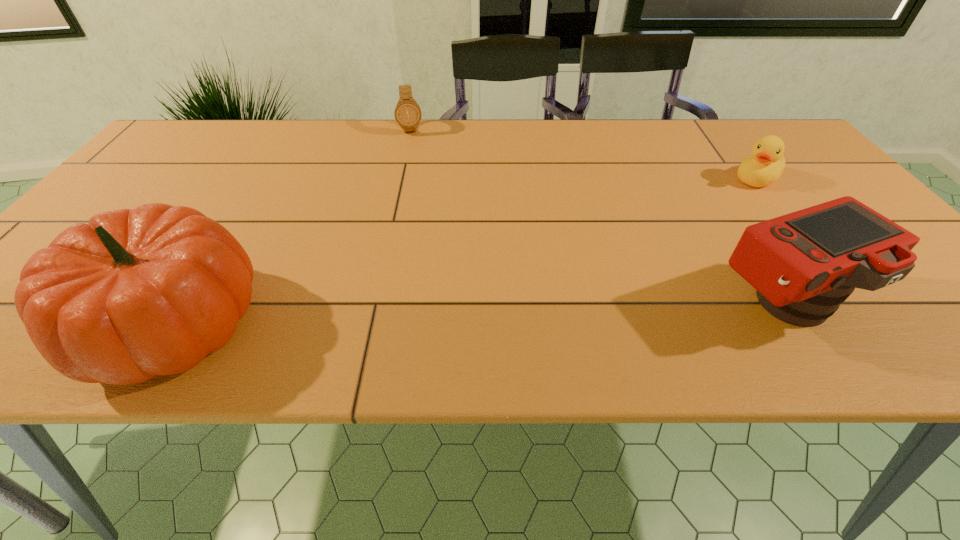
Where is `free spot between the third nearest object and the pumpkin`? This screenshot has width=960, height=540. free spot between the third nearest object and the pumpkin is located at coordinates (464, 251).

Locate an element on the screen. unoccupied area between the pumpkin and the second farthest object is located at coordinates (464, 251).

Find the location of `object that is the second nearest to the duckling`. object that is the second nearest to the duckling is located at coordinates (407, 112).

Locate an element on the screen. The height and width of the screenshot is (540, 960). object that can be found as the closest to the third nearest object is located at coordinates (803, 265).